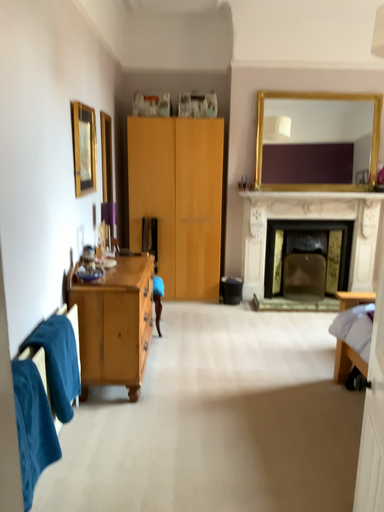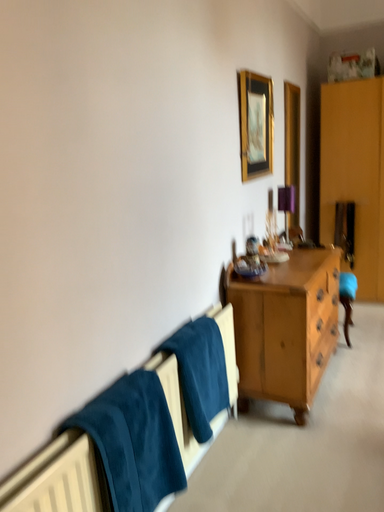
Question: How did the camera likely rotate when shooting the video?

Choices:
 (A) rotated left
 (B) rotated right

Answer: (A)